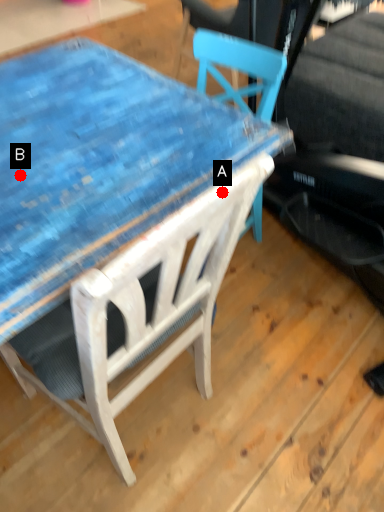
Question: Two points are circled on the image, labeled by A and B beside each circle. Which point is farther from the camera taking this photo?

Choices:
 (A) A is further
 (B) B is further

Answer: (B)